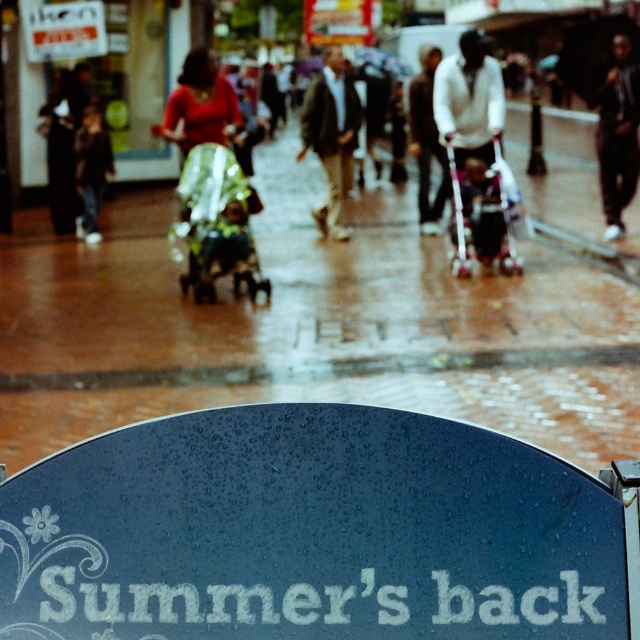
Which is above, green plastic baby carriage at center or dark brown leather jacket at center?

dark brown leather jacket at center

Based on the photo, between green plastic baby carriage at center and dark brown leather jacket at center, which one has more height?

Standing taller between the two is dark brown leather jacket at center.

At what (x,y) coordinates should I click in order to perform the action: click on green plastic baby carriage at center. Please return your answer as a coordinate pair (x, y). Looking at the image, I should click on pyautogui.click(x=216, y=221).

Is point (460, 184) positioned in front of point (352, 108)?

Yes, point (460, 184) is in front of point (352, 108).

Who is more forward, (452, 188) or (330, 58)?

Point (452, 188) is in front.

I want to click on pink plastic baby carriage at center, so click(x=483, y=212).

At what (x,y) coordinates should I click in order to perform the action: click on pink plastic baby carriage at center. Please return your answer as a coordinate pair (x, y). Image resolution: width=640 pixels, height=640 pixels. Looking at the image, I should click on (483, 212).

Can you confirm if green plastic baby carriage at center is positioned below pink plastic baby carriage at center?

Yes, green plastic baby carriage at center is below pink plastic baby carriage at center.

Which of these two, green plastic baby carriage at center or pink plastic baby carriage at center, stands taller?

With more height is green plastic baby carriage at center.

Locate an element on the screen. The height and width of the screenshot is (640, 640). green plastic baby carriage at center is located at coordinates (216, 221).

The height and width of the screenshot is (640, 640). I want to click on green plastic baby carriage at center, so click(x=216, y=221).